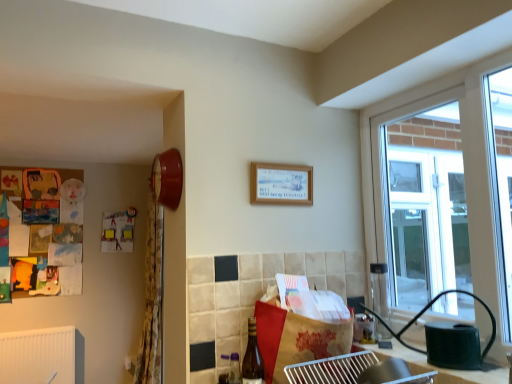
Question: Is matte red clock at upper left at the right side of wooden picture frame at upper center?

Choices:
 (A) yes
 (B) no

Answer: (B)

Question: Is wooden picture frame at upper center inside matte red clock at upper left?

Choices:
 (A) yes
 (B) no

Answer: (B)

Question: Is matte red clock at upper left turned away from wooden picture frame at upper center?

Choices:
 (A) yes
 (B) no

Answer: (A)

Question: From a real-world perspective, does matte red clock at upper left sit lower than wooden picture frame at upper center?

Choices:
 (A) yes
 (B) no

Answer: (B)

Question: Considering the relative sizes of matte red clock at upper left and wooden picture frame at upper center in the image provided, is matte red clock at upper left thinner than wooden picture frame at upper center?

Choices:
 (A) yes
 (B) no

Answer: (B)

Question: From the image's perspective, is yellow floral fabric curtain at left above or below brown glass bottle at lower center?

Choices:
 (A) below
 (B) above

Answer: (A)

Question: In the image, is yellow floral fabric curtain at left on the left side or the right side of brown glass bottle at lower center?

Choices:
 (A) right
 (B) left

Answer: (B)

Question: Is point (157, 380) closer or farther from the camera than point (245, 360)?

Choices:
 (A) closer
 (B) farther

Answer: (B)

Question: Is yellow floral fabric curtain at left in front of or behind brown glass bottle at lower center in the image?

Choices:
 (A) behind
 (B) front

Answer: (A)

Question: Is matte red clock at upper left in front of or behind wooden picture frame at upper center in the image?

Choices:
 (A) behind
 (B) front

Answer: (B)

Question: Do you think matte red clock at upper left is within wooden picture frame at upper center, or outside of it?

Choices:
 (A) inside
 (B) outside

Answer: (B)

Question: In terms of size, does matte red clock at upper left appear bigger or smaller than wooden picture frame at upper center?

Choices:
 (A) big
 (B) small

Answer: (A)

Question: Considering the relative positions of matte red clock at upper left and wooden picture frame at upper center in the image provided, is matte red clock at upper left to the left or to the right of wooden picture frame at upper center?

Choices:
 (A) left
 (B) right

Answer: (A)

Question: From the image's perspective, is brown paper bag at center located above or below matte red clock at upper left?

Choices:
 (A) above
 (B) below

Answer: (B)

Question: In the image, is brown paper bag at center on the left side or the right side of matte red clock at upper left?

Choices:
 (A) left
 (B) right

Answer: (B)